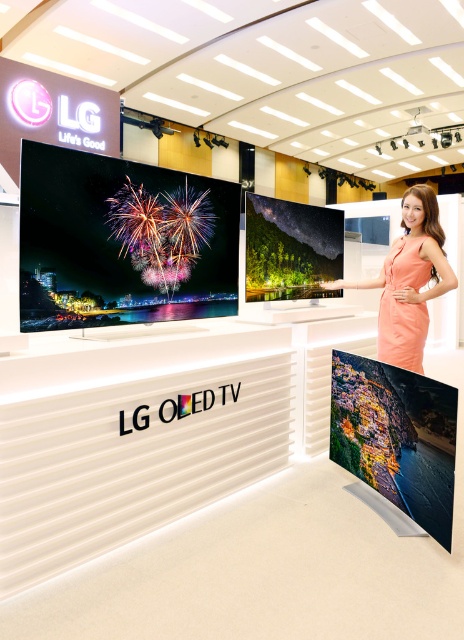
You are a customer in the LG OLED TV showroom and see two orange satin dresses displayed. The first is labeled as the orange satin dress at upper right, and the second is the orange satin dress at right. Which dress is positioned higher up in the display?

The orange satin dress at upper right is positioned higher up in the display compared to the orange satin dress at right because it is described as much taller.

You are a store employee arranging items in the LG OLED TV display. You need to place a new orange satin dress at upper right and another orange satin dress at right. Considering the space between them, can you fit a 3 inch wide decorative plaque between them?

The orange satin dress at upper right is 2.67 inches away from orange satin dress at right. Since the distance between them is less than 3 inches, the 3 inch wide decorative plaque cannot fit between them.